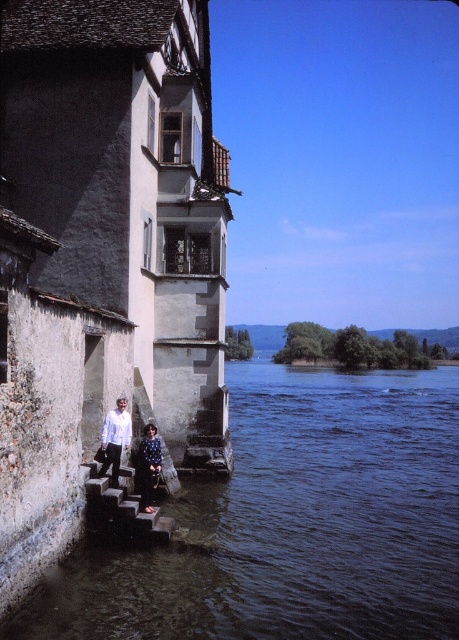
You are standing at the riverside and see the dark blue dress at lower left and the dark blue water at lower center. Which object is positioned more to the right?

The dark blue water at lower center is positioned more to the right than the dark blue dress at lower left.

You are a painter standing at the riverside and want to paint the stone steps at lower left and the dark blue textured sweater at lower center. Which object is wider?

The stone steps at lower left are wider than the dark blue textured sweater at lower center.

You are a photographer planning to take a portrait of both the dark blue dress at lower left and the dark blue textured sweater at lower center. Since you want both subjects to be visible in the frame, which one should you position closer to the camera to ensure the shorter one isn

The dark blue dress at lower left is taller than the dark blue textured sweater at lower center. To ensure both are visible, position the dark blue textured sweater at lower center closer to the camera so its height matches the taller dark blue dress at lower left in the frame.